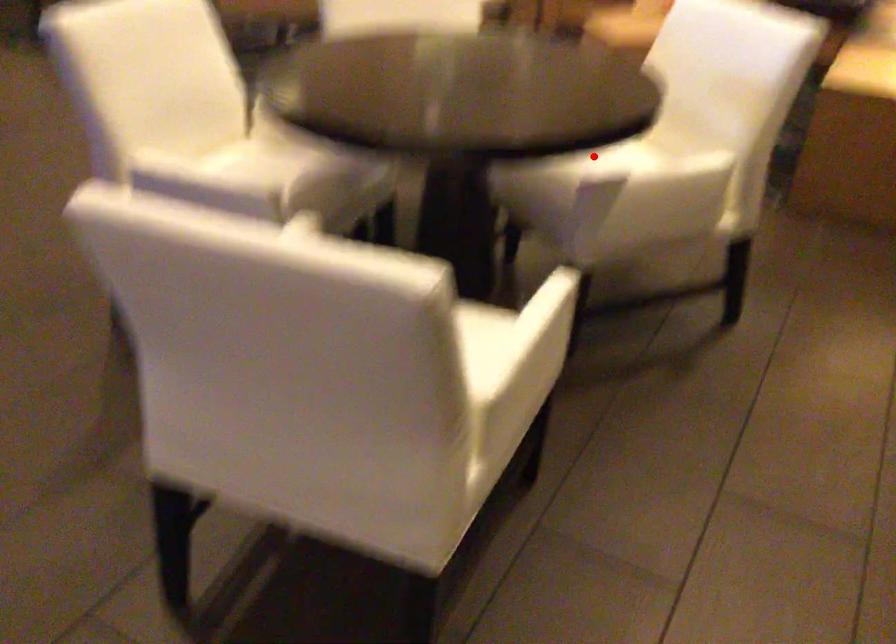
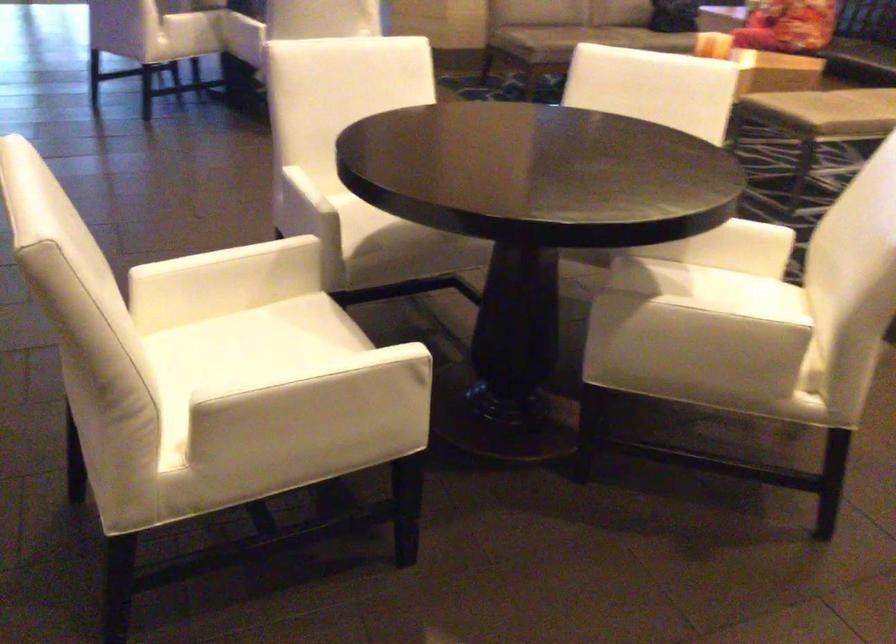
Find the pixel in the second image that matches the highlighted location in the first image.

(711, 290)